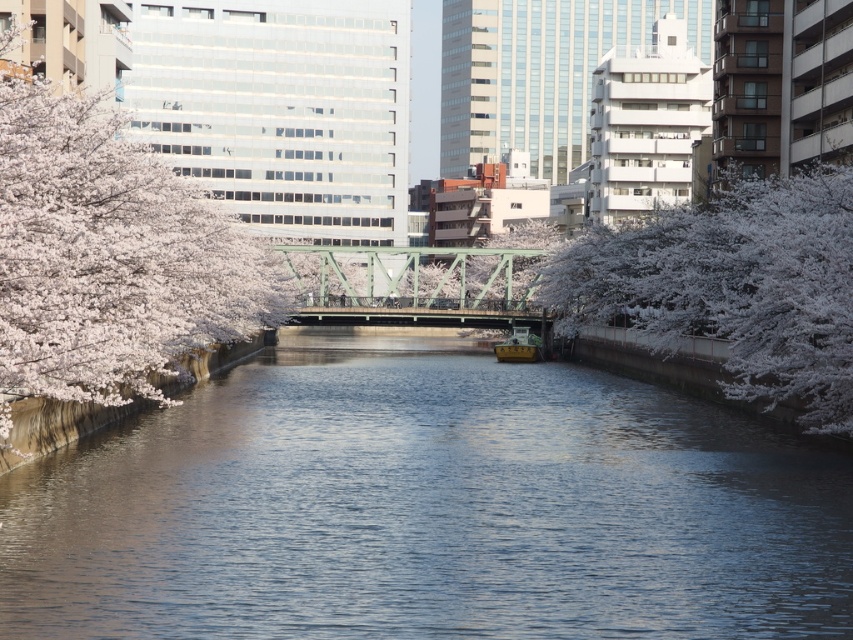
You are an artist planning to paint the cherry blossom scene. You notice two groups of white blossoms at left and white blossoms at right along the riverbanks. Which group should you paint with finer, more delicate brushstrokes to accurately represent their size and density?

The white blossoms at left should be painted with finer, more delicate brushstrokes because they are thinner than the white blossoms at right.

You are standing at the point with coordinates point [811,205] and want to walk towards the point [502,356]. According to the scene, will you be moving towards or away from the cherry blossom trees along the riverbanks?

Since point [811,205] is in front of point [502,356], moving from point [811,205] to point [502,356] means you are moving away from the cherry blossom trees along the riverbanks.